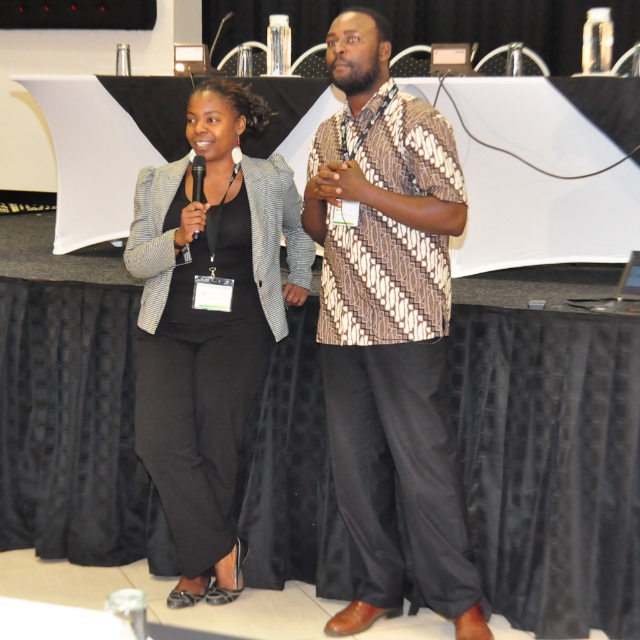
You are organizing a small conference and need to ensure that the microphone is visible to all attendees. Given the sizes of the matte black blazer at center and the black plastic microphone at center, which object is bigger and might block the microphone if placed too close?

The matte black blazer at center is larger than the black plastic microphone at center, so it might block the microphone if placed too close.

You are an event organizer who needs to adjust the lighting to focus on the speakers. Based on their positions, which object should you adjust the spotlight to first, the patterned fabric shirt at center or the black plastic microphone at center?

The patterned fabric shirt at center is positioned under the black plastic microphone at center, so you should adjust the spotlight to the black plastic microphone at center first to ensure it is properly illuminated before the shirt underneath.